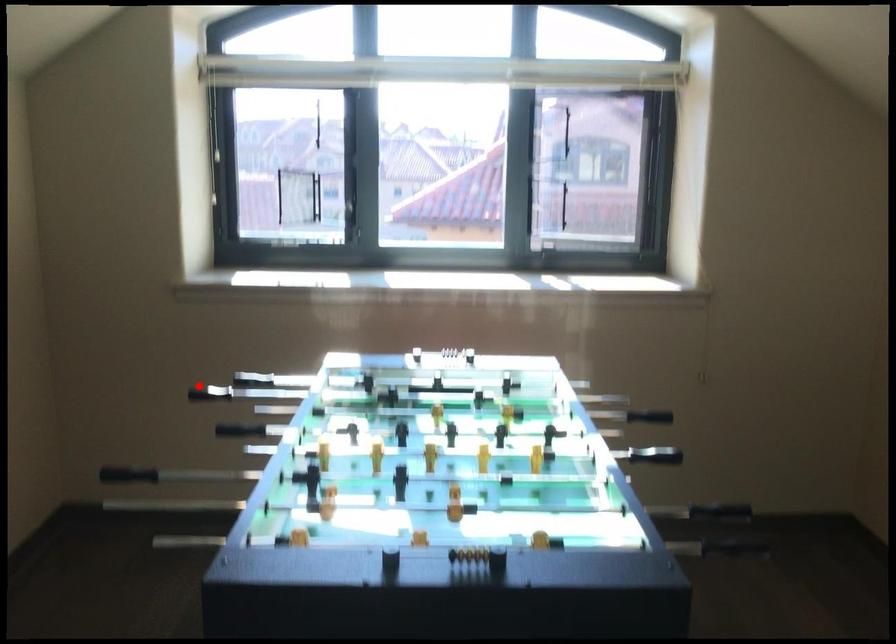
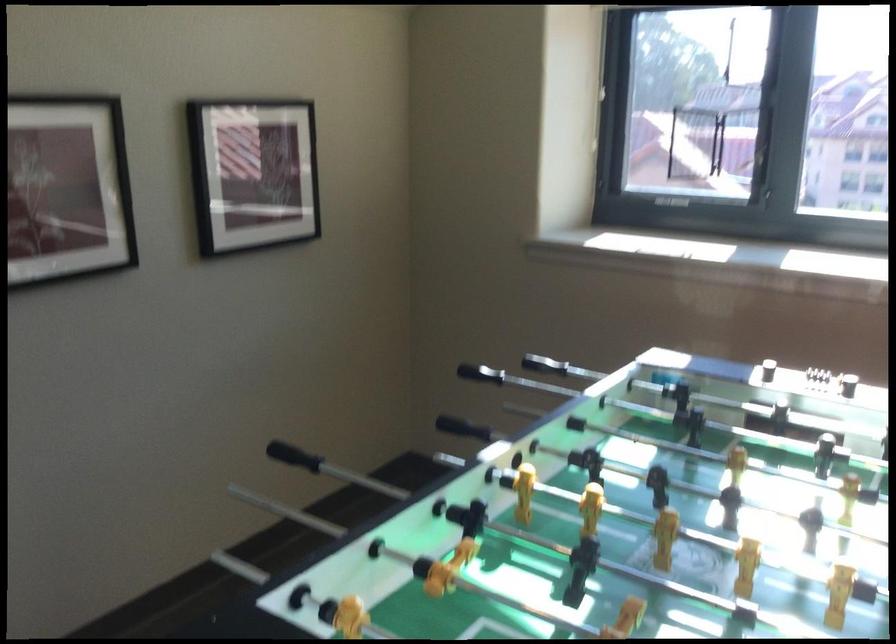
Question: A red point is marked in image1. In image2, is the corresponding 3D point closer to the camera or farther? Reply with the corresponding letter.

Choices:
 (A) The corresponding 3D point is closer.
 (B) The corresponding 3D point is farther.

Answer: (A)